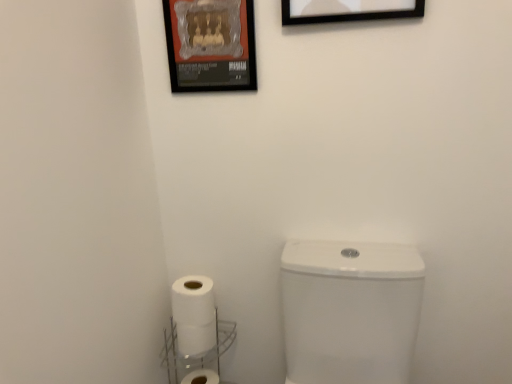
I want to click on white glossy toilet at lower right, so click(x=350, y=311).

The height and width of the screenshot is (384, 512). What do you see at coordinates (201, 377) in the screenshot?
I see `white matte toilet paper at lower left, the first toilet paper ordered from the bottom` at bounding box center [201, 377].

Find the location of `black matte picture frame at upper center, which appears as the 1th picture frame when viewed from the right`. black matte picture frame at upper center, which appears as the 1th picture frame when viewed from the right is located at coordinates (348, 10).

Does metallic poster at upper center, the 2th picture frame from the front, turn towards white matte toilet paper at lower left, which ranks as the 1th toilet paper in top-to-bottom order?

No, metallic poster at upper center, the 2th picture frame from the front, is not aimed at white matte toilet paper at lower left, which ranks as the 1th toilet paper in top-to-bottom order.

Is metallic poster at upper center, acting as the first picture frame starting from the left, in front of or behind white matte toilet paper at lower left, which ranks as the 1th toilet paper in top-to-bottom order, in the image?

Visually, metallic poster at upper center, acting as the first picture frame starting from the left, is located in front of white matte toilet paper at lower left, which ranks as the 1th toilet paper in top-to-bottom order.

From the image's perspective, is metallic poster at upper center, the 2th picture frame from the front, located above white matte toilet paper at lower left, which ranks as the 1th toilet paper in top-to-bottom order?

Yes, from the image's perspective, metallic poster at upper center, the 2th picture frame from the front, is over white matte toilet paper at lower left, which ranks as the 1th toilet paper in top-to-bottom order.

From the picture: Who is smaller, metallic poster at upper center, which ranks as the 1th picture frame in back-to-front order, or white matte toilet paper at lower left, which ranks as the 1th toilet paper in top-to-bottom order?

metallic poster at upper center, which ranks as the 1th picture frame in back-to-front order.

Does black matte picture frame at upper center, which appears as the 1th picture frame when viewed from the right, lie in front of white matte toilet paper at lower left, the 2th toilet paper positioned from the top?

Yes.

Is black matte picture frame at upper center, which appears as the 1th picture frame when viewed from the right, inside or outside of white matte toilet paper at lower left, the first toilet paper ordered from the bottom?

black matte picture frame at upper center, which appears as the 1th picture frame when viewed from the right, is spatially situated outside white matte toilet paper at lower left, the first toilet paper ordered from the bottom.

From the picture: Is black matte picture frame at upper center, which is the second picture frame in left-to-right order, looking in the opposite direction of white matte toilet paper at lower left, the 2th toilet paper positioned from the top?

black matte picture frame at upper center, which is the second picture frame in left-to-right order, is not turned away from white matte toilet paper at lower left, the 2th toilet paper positioned from the top.

Which of these two, black matte picture frame at upper center, positioned as the first picture frame in front-to-back order, or white matte toilet paper at lower left, the 2th toilet paper positioned from the top, stands shorter?

white matte toilet paper at lower left, the 2th toilet paper positioned from the top, is shorter.

Would you say white matte toilet paper at lower left, the 2th toilet paper positioned from the top, is inside or outside white plastic shelf at lower center?

white matte toilet paper at lower left, the 2th toilet paper positioned from the top, is located inside white plastic shelf at lower center.

From the image's perspective, is white matte toilet paper at lower left, the first toilet paper ordered from the bottom, over white plastic shelf at lower center?

No.

Can you confirm if white matte toilet paper at lower left, the first toilet paper ordered from the bottom, is shorter than white plastic shelf at lower center?

Indeed, white matte toilet paper at lower left, the first toilet paper ordered from the bottom, has a lesser height compared to white plastic shelf at lower center.

Considering the sizes of white glossy toilet at lower right and white matte toilet paper at lower left, marked as the second toilet paper in a bottom-to-top arrangement, in the image, is white glossy toilet at lower right taller or shorter than white matte toilet paper at lower left, marked as the second toilet paper in a bottom-to-top arrangement,?

Clearly, white glossy toilet at lower right is taller compared to white matte toilet paper at lower left, marked as the second toilet paper in a bottom-to-top arrangement.

Based on the photo, is white glossy toilet at lower right next to white matte toilet paper at lower left, marked as the second toilet paper in a bottom-to-top arrangement, and touching it?

white glossy toilet at lower right and white matte toilet paper at lower left, marked as the second toilet paper in a bottom-to-top arrangement, are clearly separated.

Between white glossy toilet at lower right and white matte toilet paper at lower left, which ranks as the 1th toilet paper in top-to-bottom order, which one is positioned behind?

white matte toilet paper at lower left, which ranks as the 1th toilet paper in top-to-bottom order.

From a real-world perspective, which object rests below the other?

white matte toilet paper at lower left, marked as the second toilet paper in a bottom-to-top arrangement.

Which is nearer, (312, 349) or (205, 361)?

The point (312, 349) is more forward.

Which object is positioned more to the right, white glossy toilet at lower right or white plastic shelf at lower center?

From the viewer's perspective, white glossy toilet at lower right appears more on the right side.

Considering the relative sizes of metallic poster at upper center, positioned as the second picture frame in right-to-left order, and white glossy toilet at lower right in the image provided, is metallic poster at upper center, positioned as the second picture frame in right-to-left order, bigger than white glossy toilet at lower right?

Actually, metallic poster at upper center, positioned as the second picture frame in right-to-left order, might be smaller than white glossy toilet at lower right.

Does metallic poster at upper center, positioned as the second picture frame in right-to-left order, contain white glossy toilet at lower right?

No, metallic poster at upper center, positioned as the second picture frame in right-to-left order, does not contain white glossy toilet at lower right.

Based on the photo, is metallic poster at upper center, positioned as the second picture frame in right-to-left order, aimed at white glossy toilet at lower right?

No, metallic poster at upper center, positioned as the second picture frame in right-to-left order, is not turned towards white glossy toilet at lower right.

Is white plastic shelf at lower center taller than metallic poster at upper center, positioned as the second picture frame in right-to-left order?

In fact, white plastic shelf at lower center may be shorter than metallic poster at upper center, positioned as the second picture frame in right-to-left order.

Which of these two, white plastic shelf at lower center or metallic poster at upper center, acting as the first picture frame starting from the left, is bigger?

white plastic shelf at lower center.

Between white plastic shelf at lower center and metallic poster at upper center, the 2th picture frame from the front, which one is positioned in front?

metallic poster at upper center, the 2th picture frame from the front, is closer to the camera.

Is metallic poster at upper center, the 2th picture frame from the front, at the back of white plastic shelf at lower center?

No, white plastic shelf at lower center is not facing the opposite direction of metallic poster at upper center, the 2th picture frame from the front.

Which toilet paper is the 1st one when counting from the back of the metallic poster at upper center, acting as the first picture frame starting from the left? Please provide its 2D coordinates.

[(197, 337)]

From the image's perspective, which toilet paper is the 2nd one below the black matte picture frame at upper center, the second picture frame when ordered from back to front? Please provide its 2D coordinates.

[(201, 377)]

Looking at the image, which one is located further to white matte toilet paper at lower left, marked as the second toilet paper in a bottom-to-top arrangement, white glossy toilet at lower right or metallic poster at upper center, which ranks as the 1th picture frame in back-to-front order?

metallic poster at upper center, which ranks as the 1th picture frame in back-to-front order, is positioned further to the anchor white matte toilet paper at lower left, marked as the second toilet paper in a bottom-to-top arrangement.

Considering their positions, is white glossy toilet at lower right positioned closer to white matte toilet paper at lower left, the first toilet paper ordered from the bottom, than black matte picture frame at upper center, positioned as the first picture frame in front-to-back order?

The object closer to white matte toilet paper at lower left, the first toilet paper ordered from the bottom, is white glossy toilet at lower right.

Estimate the real-world distances between objects in this image. Which object is further from white matte toilet paper at lower left, marked as the second toilet paper in a bottom-to-top arrangement, black matte picture frame at upper center, the second picture frame when ordered from back to front, or white plastic shelf at lower center?

black matte picture frame at upper center, the second picture frame when ordered from back to front, is positioned further to the anchor white matte toilet paper at lower left, marked as the second toilet paper in a bottom-to-top arrangement.

Estimate the real-world distances between objects in this image. Which object is closer to white matte toilet paper at lower left, which ranks as the 1th toilet paper in top-to-bottom order, white matte toilet paper at lower left, the 2th toilet paper positioned from the top, or metallic poster at upper center, the 2th picture frame from the front?

The object closer to white matte toilet paper at lower left, which ranks as the 1th toilet paper in top-to-bottom order, is white matte toilet paper at lower left, the 2th toilet paper positioned from the top.

In the scene shown: Which object lies further to the anchor point white matte toilet paper at lower left, the 2th toilet paper positioned from the top, metallic poster at upper center, which ranks as the 1th picture frame in back-to-front order, or white matte toilet paper at lower left, marked as the second toilet paper in a bottom-to-top arrangement?

metallic poster at upper center, which ranks as the 1th picture frame in back-to-front order, is further to white matte toilet paper at lower left, the 2th toilet paper positioned from the top.

Estimate the real-world distances between objects in this image. Which object is further from white glossy toilet at lower right, white plastic shelf at lower center or white matte toilet paper at lower left, which ranks as the 1th toilet paper in top-to-bottom order?

white matte toilet paper at lower left, which ranks as the 1th toilet paper in top-to-bottom order, is further to white glossy toilet at lower right.

Based on the photo, based on their spatial positions, is metallic poster at upper center, acting as the first picture frame starting from the left, or white matte toilet paper at lower left, the first toilet paper ordered from the bottom, further from white plastic shelf at lower center?

The object further to white plastic shelf at lower center is metallic poster at upper center, acting as the first picture frame starting from the left.

Estimate the real-world distances between objects in this image. Which object is closer to white glossy toilet at lower right, white plastic shelf at lower center or black matte picture frame at upper center, which appears as the 1th picture frame when viewed from the right?

Based on the image, white plastic shelf at lower center appears to be nearer to white glossy toilet at lower right.

This screenshot has height=384, width=512. Find the location of `toilet paper between black matte picture frame at upper center, which is the second picture frame in left-to-right order, and white matte toilet paper at lower left, the first toilet paper ordered from the bottom, vertically`. toilet paper between black matte picture frame at upper center, which is the second picture frame in left-to-right order, and white matte toilet paper at lower left, the first toilet paper ordered from the bottom, vertically is located at coordinates (197, 337).

Where is `toilet paper between white glossy toilet at lower right and white matte toilet paper at lower left, the first toilet paper ordered from the bottom, in the front-back direction`? Image resolution: width=512 pixels, height=384 pixels. toilet paper between white glossy toilet at lower right and white matte toilet paper at lower left, the first toilet paper ordered from the bottom, in the front-back direction is located at coordinates (197, 337).

The width and height of the screenshot is (512, 384). What are the coordinates of `shelf between black matte picture frame at upper center, the second picture frame when ordered from back to front, and white matte toilet paper at lower left, the first toilet paper ordered from the bottom, in the vertical direction` in the screenshot? It's located at pyautogui.click(x=197, y=354).

The image size is (512, 384). I want to click on picture frame between black matte picture frame at upper center, positioned as the first picture frame in front-to-back order, and white glossy toilet at lower right from top to bottom, so click(x=210, y=45).